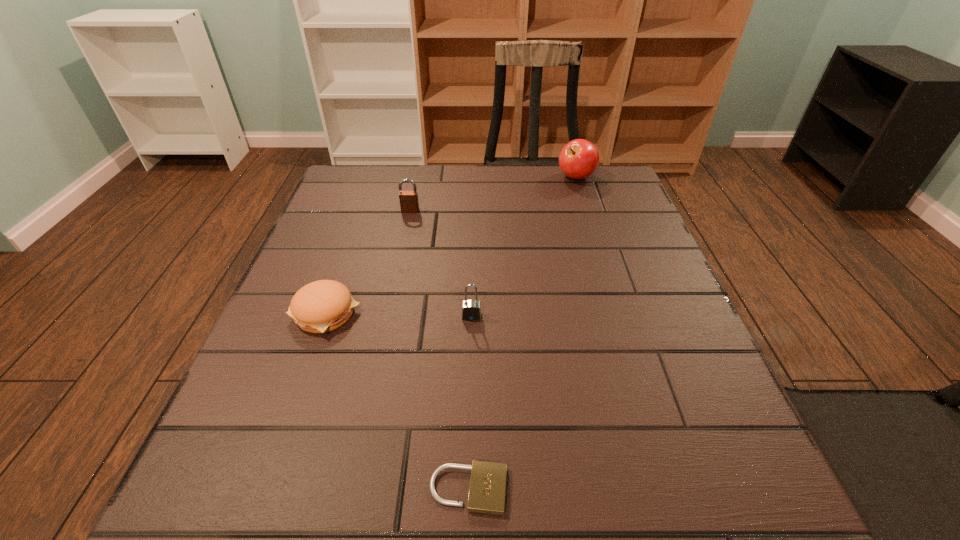
Image resolution: width=960 pixels, height=540 pixels. Identify the location of free spot between the shortest padlock and the apple. (522, 334).

Find the location of `vacant area that lies between the leftmost padlock and the leftmost object`. vacant area that lies between the leftmost padlock and the leftmost object is located at coordinates tap(368, 262).

Locate an element on the screen. This screenshot has height=540, width=960. vacant space that is in between the leftmost object and the apple is located at coordinates (451, 245).

Locate an element on the screen. free space between the second farthest padlock and the fourth nearest object is located at coordinates (441, 264).

Identify the location of unoccupied position between the farthest object and the nearest padlock. Image resolution: width=960 pixels, height=540 pixels. (522, 334).

Locate an element on the screen. Image resolution: width=960 pixels, height=540 pixels. free space between the farthest padlock and the nearest padlock is located at coordinates (440, 350).

Choose which object is the second nearest neighbor to the nearest padlock. Please provide its 2D coordinates. Your answer should be formatted as a tuple, i.e. [(x, y)], where the tuple contains the x and y coordinates of a point satisfying the conditions above.

[(322, 306)]

Identify which object is the closest to the nearest object. Please provide its 2D coordinates. Your answer should be formatted as a tuple, i.e. [(x, y)], where the tuple contains the x and y coordinates of a point satisfying the conditions above.

[(471, 310)]

I want to click on padlock that stands as the closest to the nearest object, so click(471, 310).

Find the location of a particular element. padlock that stands as the second closest to the second farthest padlock is located at coordinates (409, 203).